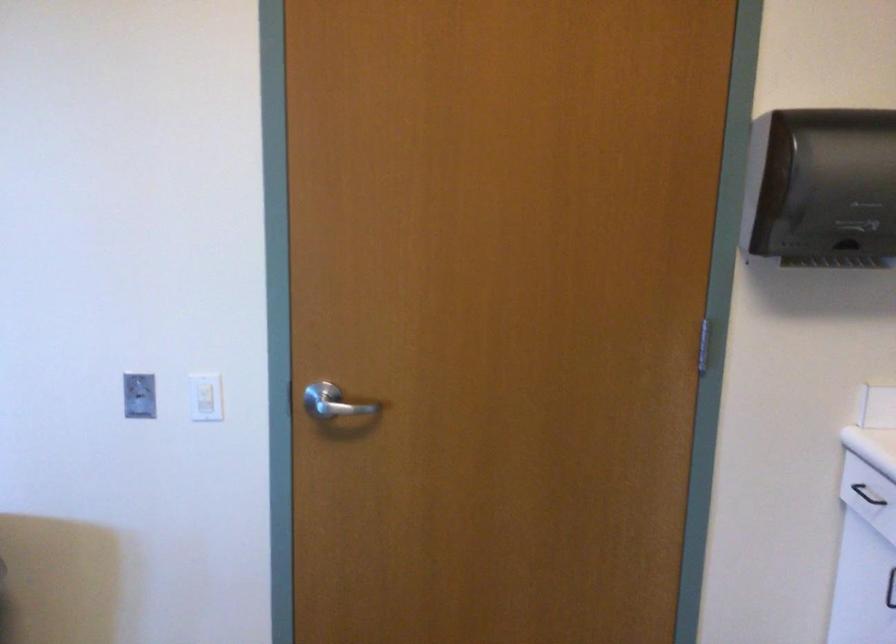
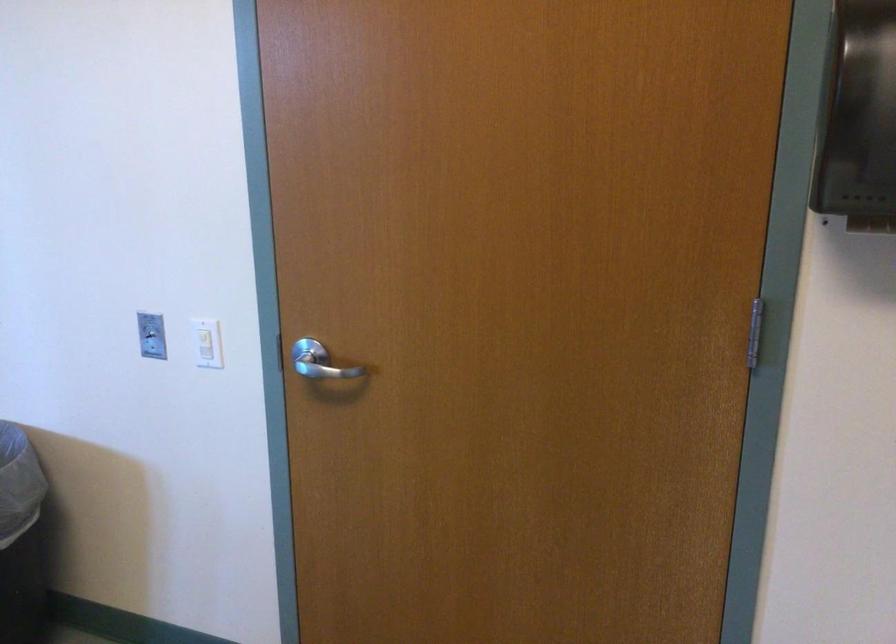
Where in the second image is the point corresponding to point 140,393 from the first image?

(151, 333)